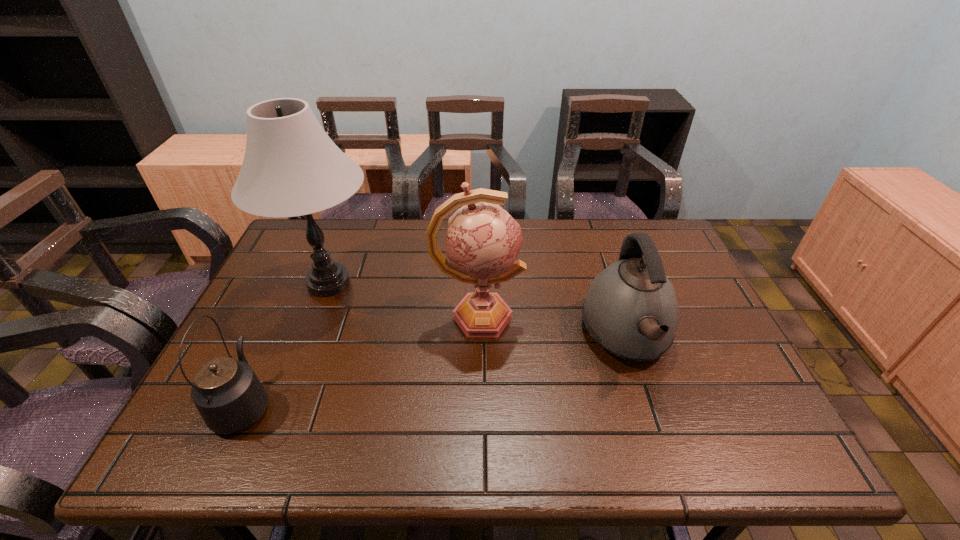
Locate an element on the screen. lamp is located at coordinates (291, 167).

I want to click on globe, so click(483, 240).

Where is `the second tallest object`? the second tallest object is located at coordinates (483, 240).

This screenshot has height=540, width=960. In order to click on the right kettle in this screenshot , I will do `click(631, 310)`.

Where is `the left kettle`? The width and height of the screenshot is (960, 540). the left kettle is located at coordinates (227, 393).

Where is `vacant space located on the back of the lamp`? This screenshot has height=540, width=960. vacant space located on the back of the lamp is located at coordinates (348, 231).

Locate an element on the screen. The width and height of the screenshot is (960, 540). free space located on the front-facing side of the globe is located at coordinates (641, 316).

Image resolution: width=960 pixels, height=540 pixels. I want to click on vacant area located at the spout of the right kettle, so click(x=664, y=451).

The image size is (960, 540). I want to click on vacant space situated 0.150m spout on the left kettle, so click(281, 323).

The image size is (960, 540). Find the location of `vacant area located 0.290m spout on the left kettle`. vacant area located 0.290m spout on the left kettle is located at coordinates (298, 288).